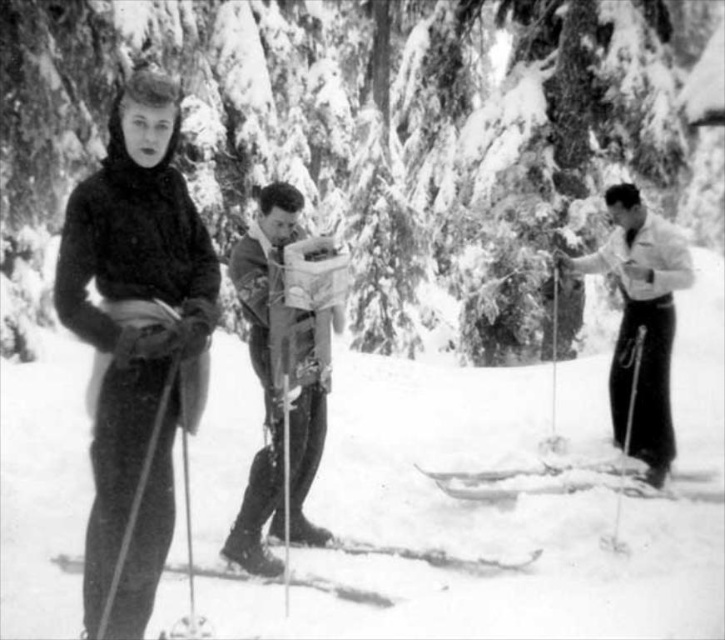
Between snowy evergreen tree at center and smooth wood skis at center, which one has less height?

Standing shorter between the two is smooth wood skis at center.

What do you see at coordinates (368, 140) in the screenshot? I see `snowy evergreen tree at center` at bounding box center [368, 140].

You are a GUI agent. You are given a task and a screenshot of the screen. Output one action in this format:
    pyautogui.click(x=<x>, y=<y>)
    Task: Click on the snowy evergreen tree at center
    
    Given the screenshot: What is the action you would take?
    pyautogui.click(x=368, y=140)

The image size is (725, 640). What do you see at coordinates (341, 589) in the screenshot? I see `metallic skis at lower left` at bounding box center [341, 589].

Does metallic skis at lower left have a lesser width compared to metallic silver ski pole at center?

Incorrect, metallic skis at lower left's width is not less than metallic silver ski pole at center's.

Which is behind, point (335, 595) or point (290, 497)?

The point (290, 497) is behind.

I want to click on metallic skis at lower left, so click(x=341, y=589).

Who is positioned more to the right, white glossy skis at right or metallic skis at lower center?

Positioned to the right is white glossy skis at right.

Is point (662, 369) farther from viewer compared to point (647, 488)?

Yes.

The width and height of the screenshot is (725, 640). What are the coordinates of `white glossy skis at right` in the screenshot? It's located at (639, 321).